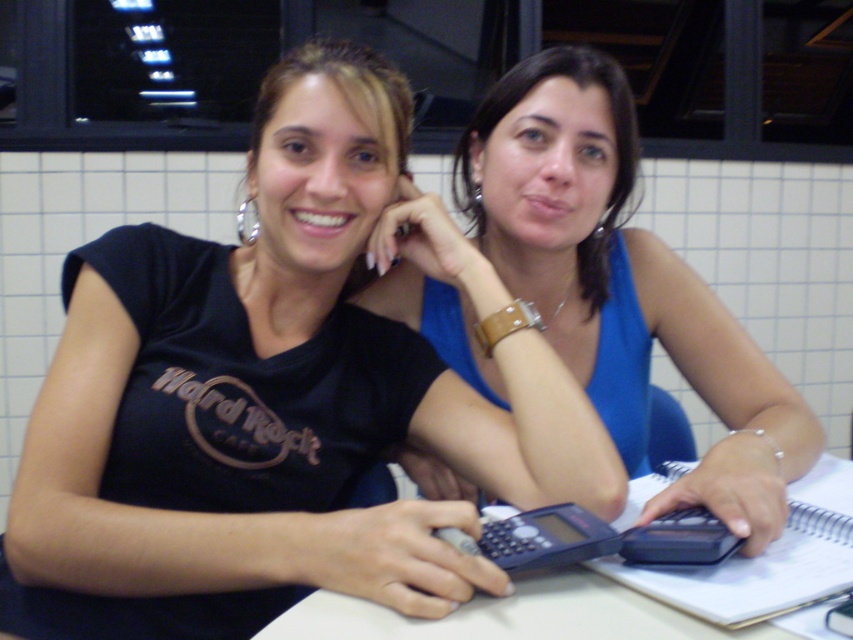
You are a photographer trying to capture a candid shot of the two people at the table. Since the blue fabric tank top at center and the white plastic table at center are in your viewfinder, where should you position the tank top relative to the table to ensure it aligns with the existing scene?

The blue fabric tank top at center is positioned on the left side of white plastic table at center, so to align with the existing scene, the tank top should be placed to the left of the table.

You are a customer at the cafe and want to place an order for a coffee. The barista asks you to point to the menu item you want. The menu is located at the wall behind the black matte calculator at center. Where should you look to find the menu?

The menu is located on the wall behind the black matte calculator at center, so you should look behind the black matte calculator at center to find the menu.